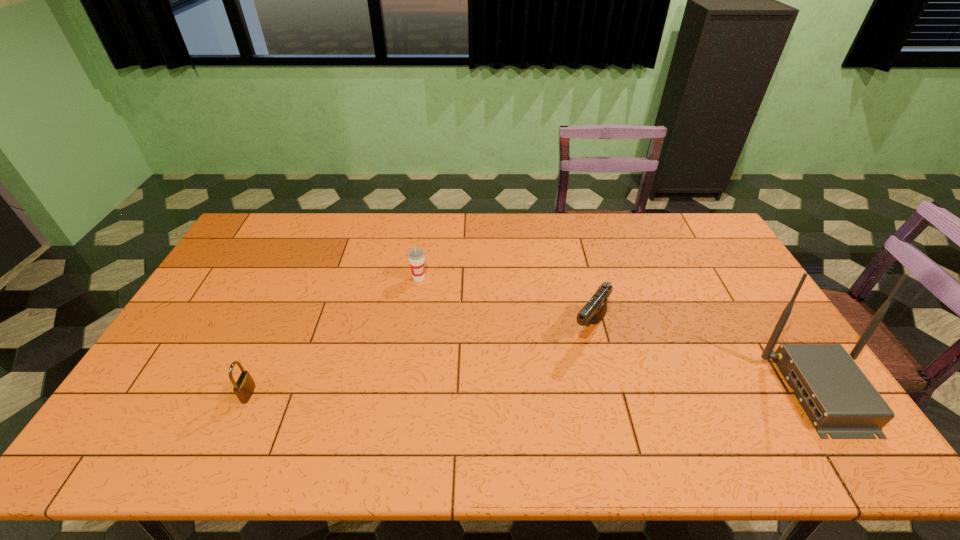
The height and width of the screenshot is (540, 960). Find the location of `vacant position at the left edge of the desktop`. vacant position at the left edge of the desktop is located at coordinates (228, 275).

Locate an element on the screen. The width and height of the screenshot is (960, 540). vacant area at the right edge is located at coordinates pyautogui.click(x=727, y=312).

In the image, there is a desktop. Where is `vacant space at the far left corner`? This screenshot has width=960, height=540. vacant space at the far left corner is located at coordinates (253, 232).

I want to click on blank region between the cup and the second farthest object, so click(504, 303).

In order to click on vacant space in between the second farthest object and the padlock in this screenshot , I will do 419,361.

Image resolution: width=960 pixels, height=540 pixels. I want to click on unoccupied position between the router and the farthest object, so click(620, 335).

The image size is (960, 540). I want to click on vacant area that lies between the tallest object and the padlock, so pyautogui.click(x=536, y=393).

Identify the location of free space between the cup and the padlock. [x=334, y=336].

Identify the location of unoccupied position between the farthest object and the third nearest object. The width and height of the screenshot is (960, 540). (504, 303).

Locate an element on the screen. This screenshot has width=960, height=540. vacant space that is in between the cup and the second object from right to left is located at coordinates (504, 303).